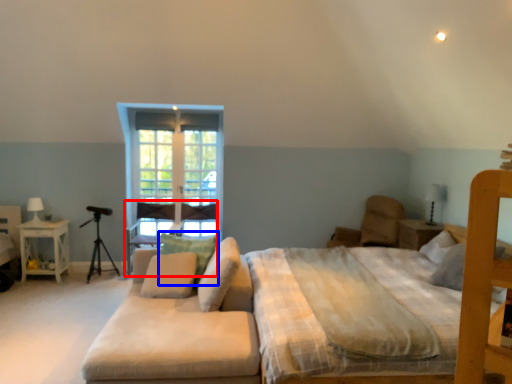
Question: Among these objects, which one is nearest to the camera, armchair (highlighted by a red box) or pillow (highlighted by a blue box)?

Choices:
 (A) armchair
 (B) pillow

Answer: (B)